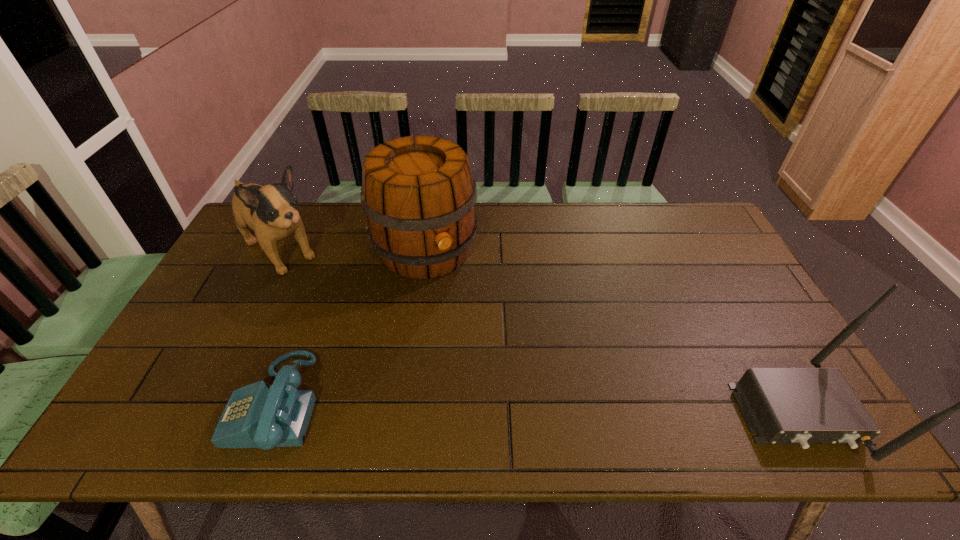
Locate an element on the screen. This screenshot has width=960, height=540. object present at the near right corner is located at coordinates (803, 406).

Identify the location of vacant space at the far edge. tap(662, 238).

This screenshot has height=540, width=960. In the image, there is a desktop. Find the location of `free space at the near edge`. free space at the near edge is located at coordinates (606, 376).

The height and width of the screenshot is (540, 960). In the image, there is a desktop. In order to click on free space at the left edge in this screenshot , I will do `click(255, 252)`.

You are a GUI agent. You are given a task and a screenshot of the screen. Output one action in this format:
    pyautogui.click(x=<x>, y=<y>)
    Task: Click on the vacant position at the right edge of the desktop
    The image size is (960, 540).
    Given the screenshot: What is the action you would take?
    pyautogui.click(x=758, y=330)

I want to click on free space at the far right corner of the desktop, so click(699, 240).

Image resolution: width=960 pixels, height=540 pixels. I want to click on vacant region between the cider and the puppy, so click(353, 251).

In order to click on free space between the puppy and the third object from left to right in this screenshot , I will do `click(353, 251)`.

Where is `free area in between the third object from left to right and the telephone`? This screenshot has height=540, width=960. free area in between the third object from left to right and the telephone is located at coordinates (350, 327).

Locate an element on the screen. vacant space in between the cider and the shortest object is located at coordinates (350, 327).